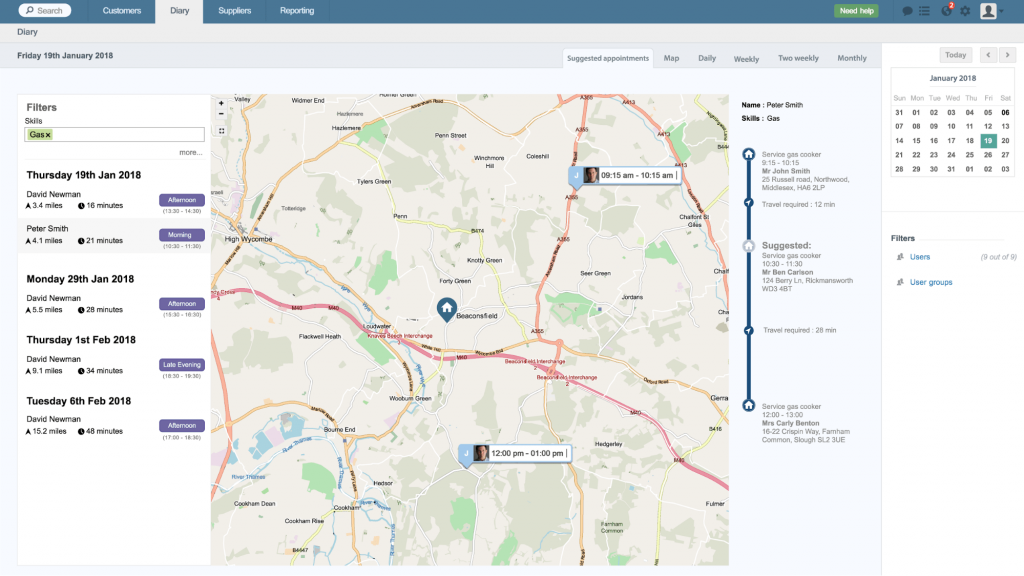
Locate an element on the screen. january calender is located at coordinates (948, 75).